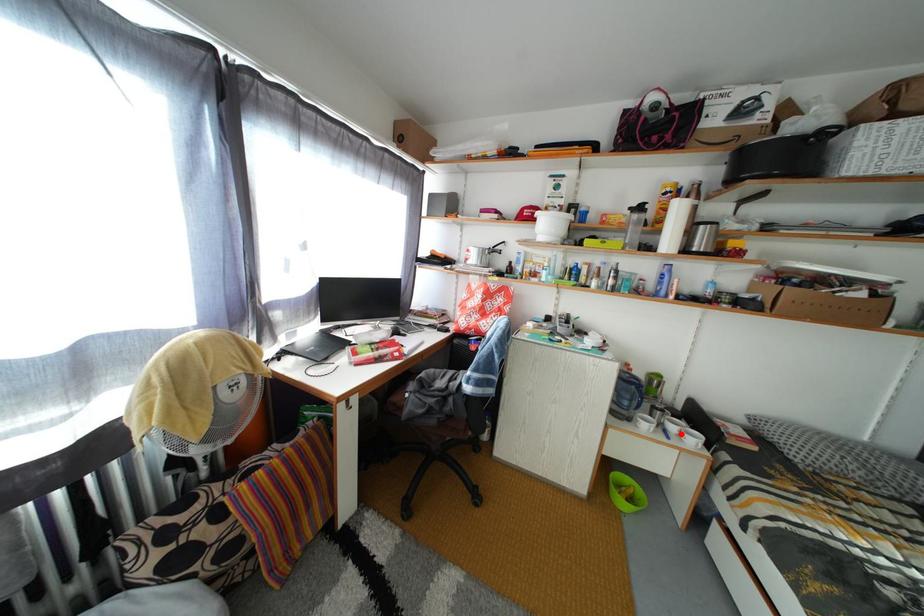
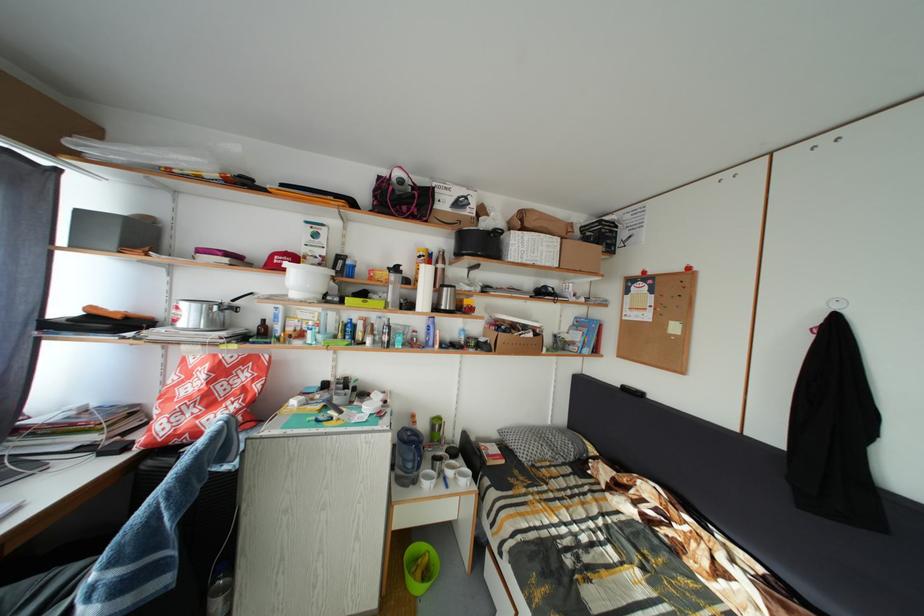
In the second image, find the point that corresponds to the highlighted location in the first image.

(458, 480)